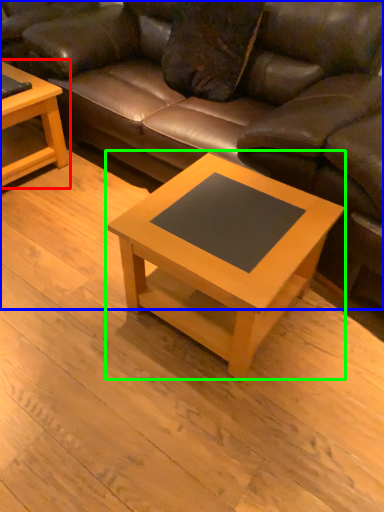
Question: Which object is the closest to the coffee table (highlighted by a red box)? Choose among these: studio couch (highlighted by a blue box) or coffee table (highlighted by a green box).

Choices:
 (A) studio couch
 (B) coffee table

Answer: (A)